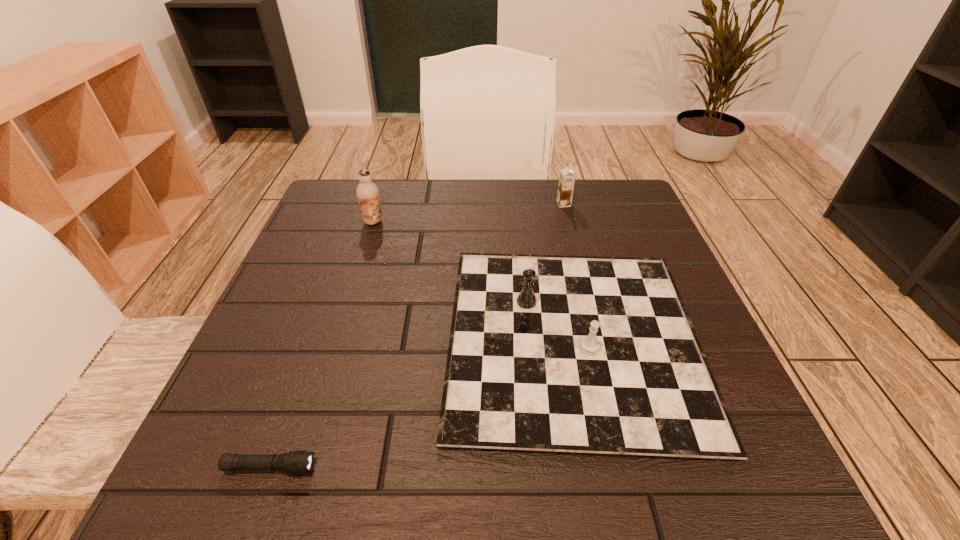
Identify which object is the closest to the right chocolate milk. Please provide its 2D coordinates. Your answer should be formatted as a tuple, i.e. [(x, y)], where the tuple contains the x and y coordinates of a point satisfying the conditions above.

[(594, 355)]

Point out which object is positioned as the third nearest to the nearer chocolate milk. Please provide its 2D coordinates. Your answer should be formatted as a tuple, i.e. [(x, y)], where the tuple contains the x and y coordinates of a point satisfying the conditions above.

[(296, 462)]

Where is `vacant point that satisfies the following two spatial constraints: 1. on the back side of the farthest object; 2. on the left side of the gameboard`? The width and height of the screenshot is (960, 540). vacant point that satisfies the following two spatial constraints: 1. on the back side of the farthest object; 2. on the left side of the gameboard is located at coordinates (545, 204).

Identify the location of free region that satisfies the following two spatial constraints: 1. on the front side of the taller chocolate milk; 2. at the lens end of the shortest object. tap(297, 467).

Find the location of `blank space that satisfies the following two spatial constraints: 1. on the back side of the shorter chocolate milk; 2. on the right side of the third nearest object`. blank space that satisfies the following two spatial constraints: 1. on the back side of the shorter chocolate milk; 2. on the right side of the third nearest object is located at coordinates (379, 204).